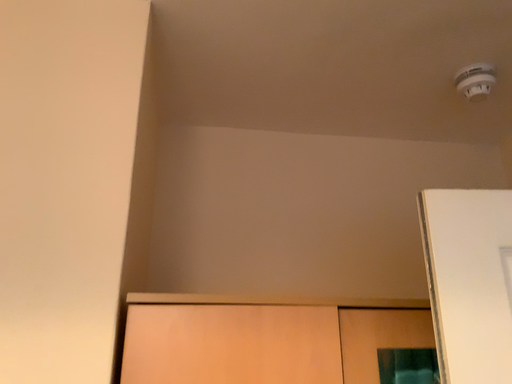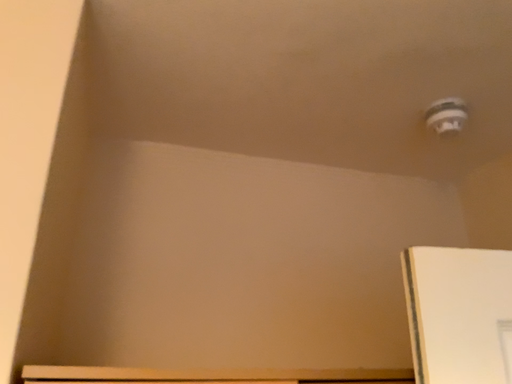
Question: How did the camera likely rotate when shooting the video?

Choices:
 (A) rotated left
 (B) rotated right

Answer: (B)